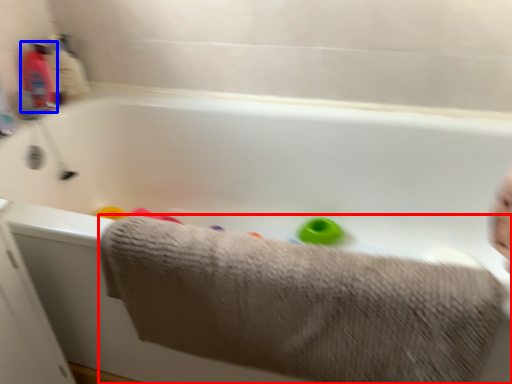
Question: Which point is closer to the camera, towel (highlighted by a red box) or baby bottle (highlighted by a blue box)?

Choices:
 (A) towel
 (B) baby bottle

Answer: (A)